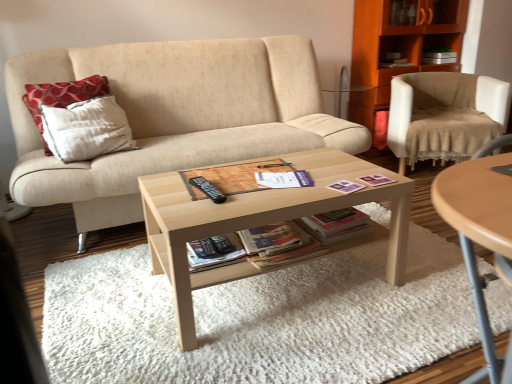
The image size is (512, 384). I want to click on matte paper paperback book at center, which ranks as the first paperback book in right-to-left order, so click(x=272, y=238).

This screenshot has width=512, height=384. What are the coordinates of `red dotted fabric pillow at left` in the screenshot? It's located at (62, 95).

Could you measure the distance between black matte paperback book at center, arranged as the second paperback book when viewed from the right, and light wood/texture coffee table at center?

The distance of black matte paperback book at center, arranged as the second paperback book when viewed from the right, from light wood/texture coffee table at center is 11.37 inches.

Image resolution: width=512 pixels, height=384 pixels. What are the coordinates of `coffee table above the black matte paperback book at center, arranged as the second paperback book when viewed from the right (from a real-world perspective)` in the screenshot? It's located at (262, 221).

Is black matte paperback book at center, the 1th paperback book in the left-to-right sequence, to the left or to the right of light wood/texture coffee table at center in the image?

black matte paperback book at center, the 1th paperback book in the left-to-right sequence, is positioned on light wood/texture coffee table at center's left side.

Is black matte paperback book at center, arranged as the second paperback book when viewed from the right, positioned beyond the bounds of light wood/texture coffee table at center?

No, black matte paperback book at center, arranged as the second paperback book when viewed from the right, is inside light wood/texture coffee table at center's boundary.

Between light wood/texture coffee table at center and red dotted fabric pillow at left, which one has larger width?

Wider between the two is light wood/texture coffee table at center.

Is light wood/texture coffee table at center taller than red dotted fabric pillow at left?

Incorrect, the height of light wood/texture coffee table at center is not larger of that of red dotted fabric pillow at left.

Consider the image. Which is more to the right, light wood/texture coffee table at center or red dotted fabric pillow at left?

light wood/texture coffee table at center.

From the image's perspective, which one is positioned lower, light wood/texture coffee table at center or red dotted fabric pillow at left?

light wood/texture coffee table at center, from the image's perspective.

From the image's perspective, is matte paper paperback book at center, which ranks as the first paperback book in right-to-left order, beneath beige fabric chair at right?

Yes, from the image's perspective, matte paper paperback book at center, which ranks as the first paperback book in right-to-left order, is below beige fabric chair at right.

Which is correct: matte paper paperback book at center, the second paperback book from the left, is inside beige fabric chair at right, or outside of it?

matte paper paperback book at center, the second paperback book from the left, is not inside beige fabric chair at right, it's outside.

Is matte paper paperback book at center, which ranks as the first paperback book in right-to-left order, wider than beige fabric chair at right?

In fact, matte paper paperback book at center, which ranks as the first paperback book in right-to-left order, might be narrower than beige fabric chair at right.

Which is in front, point (291, 149) or point (467, 9)?

Positioned in front is point (291, 149).

Consider the image. Would you say beige fabric couch at center is outside wooden cabinet at upper right?

That's correct, beige fabric couch at center is outside of wooden cabinet at upper right.

From the image's perspective, which one is positioned higher, beige fabric couch at center or wooden cabinet at upper right?

From the image's view, wooden cabinet at upper right is above.

Considering the relative sizes of beige fabric couch at center and wooden cabinet at upper right in the image provided, is beige fabric couch at center bigger than wooden cabinet at upper right?

Indeed, beige fabric couch at center has a larger size compared to wooden cabinet at upper right.

Can you confirm if matte paper paperback book at center, which ranks as the first paperback book in right-to-left order, is thinner than beige fabric couch at center?

Yes, matte paper paperback book at center, which ranks as the first paperback book in right-to-left order, is thinner than beige fabric couch at center.

From a real-world perspective, is matte paper paperback book at center, the second paperback book from the left, above or below beige fabric couch at center?

Clearly, from a real-world perspective, matte paper paperback book at center, the second paperback book from the left, is below beige fabric couch at center.

Based on the photo, relative to beige fabric couch at center, is matte paper paperback book at center, which ranks as the first paperback book in right-to-left order, in front or behind?

In the image, matte paper paperback book at center, which ranks as the first paperback book in right-to-left order, appears in front of beige fabric couch at center.

Is matte paper paperback book at center, the second paperback book from the left, to the right of beige fabric couch at center from the viewer's perspective?

Correct, you'll find matte paper paperback book at center, the second paperback book from the left, to the right of beige fabric couch at center.

Does point (246, 302) come behind point (432, 38)?

No, it is in front of (432, 38).

Could you tell me if light wood coffee table at center is facing wooden cabinet at upper right?

No, light wood coffee table at center does not turn towards wooden cabinet at upper right.

Considering the sizes of objects light wood coffee table at center and wooden cabinet at upper right in the image provided, who is shorter, light wood coffee table at center or wooden cabinet at upper right?

Standing shorter between the two is light wood coffee table at center.

At what (x,y) coordinates should I click in order to perform the action: click on cabinetry that is above the beige fabric chair at right (from the image's perspective). Please return your answer as a coordinate pair (x, y). The width and height of the screenshot is (512, 384). Looking at the image, I should click on (399, 46).

Is wooden cabinet at upper right positioned far away from beige fabric chair at right?

No, wooden cabinet at upper right is in close proximity to beige fabric chair at right.

Do you think wooden cabinet at upper right is within beige fabric chair at right, or outside of it?

wooden cabinet at upper right is located beyond the bounds of beige fabric chair at right.

Identify the location of coffee table on the right of black matte paperback book at center, the 1th paperback book in the left-to-right sequence. (262, 221).

In order to click on coffee table in front of the red dotted fabric pillow at left in this screenshot , I will do `click(262, 221)`.

Based on their spatial positions, is black matte paperback book at center, arranged as the second paperback book when viewed from the right, or white paper at center further from red dotted fabric pillow at left?

black matte paperback book at center, arranged as the second paperback book when viewed from the right.

Based on their spatial positions, is wooden cabinet at upper right or beige fabric chair at right closer to light wood coffee table at center?

Among the two, beige fabric chair at right is located nearer to light wood coffee table at center.

Looking at this image, considering their positions, is white paper at center positioned further to red dotted fabric pillow at left than matte paper paperback book at center, which ranks as the first paperback book in right-to-left order?

matte paper paperback book at center, which ranks as the first paperback book in right-to-left order, is positioned further to the anchor red dotted fabric pillow at left.

Based on their spatial positions, is wooden cabinet at upper right or white paper at center closer to beige fabric chair at right?

Among the two, wooden cabinet at upper right is located nearer to beige fabric chair at right.

Looking at the image, which one is located closer to matte paper paperback book at center, the second paperback book from the left, white paper at center or wooden cabinet at upper right?

The object closer to matte paper paperback book at center, the second paperback book from the left, is white paper at center.

Based on their spatial positions, is white paper at center or black matte paperback book at center, the 1th paperback book in the left-to-right sequence, closer to light wood coffee table at center?

black matte paperback book at center, the 1th paperback book in the left-to-right sequence.

Considering their positions, is matte paper paperback book at center, the second paperback book from the left, positioned closer to white paper at center than wooden cabinet at upper right?

matte paper paperback book at center, the second paperback book from the left.

Looking at the image, which one is located closer to matte paper paperback book at center, the second paperback book from the left, light wood coffee table at center or beige fabric chair at right?

Among the two, light wood coffee table at center is located nearer to matte paper paperback book at center, the second paperback book from the left.

What are the coordinates of `coffee table located between matte paper paperback book at center, the second paperback book from the left, and beige fabric chair at right in the left-right direction` in the screenshot? It's located at (262, 221).

The height and width of the screenshot is (384, 512). What are the coordinates of `studio couch between red dotted fabric pillow at left and matte paper paperback book at center, the second paperback book from the left` in the screenshot? It's located at (174, 117).

Identify the location of coffee table between light wood coffee table at center and wooden cabinet at upper right in the front-back direction. This screenshot has height=384, width=512. (262, 221).

At what (x,y) coordinates should I click in order to perform the action: click on chair between white paper at center and wooden cabinet at upper right in the front-back direction. Please return your answer as a coordinate pair (x, y). This screenshot has height=384, width=512. Looking at the image, I should click on [444, 115].